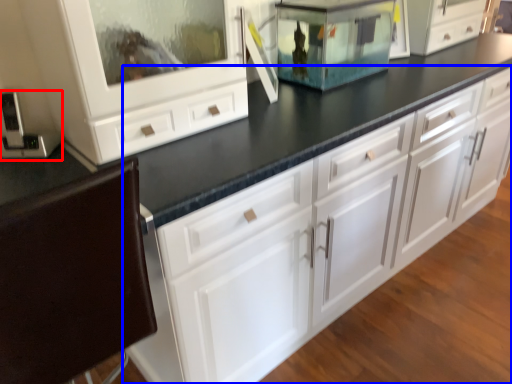
Question: Among these objects, which one is nearest to the camera, appliance (highlighted by a red box) or chest of drawers (highlighted by a blue box)?

Choices:
 (A) appliance
 (B) chest of drawers

Answer: (B)